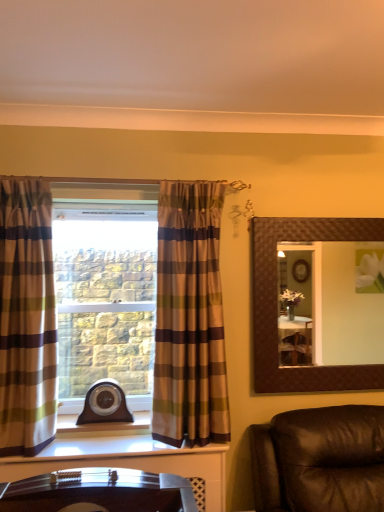
This screenshot has width=384, height=512. I want to click on free spot below plaid fabric curtain at left, the 2th curtain positioned from the right (from a real-world perspective), so click(x=20, y=456).